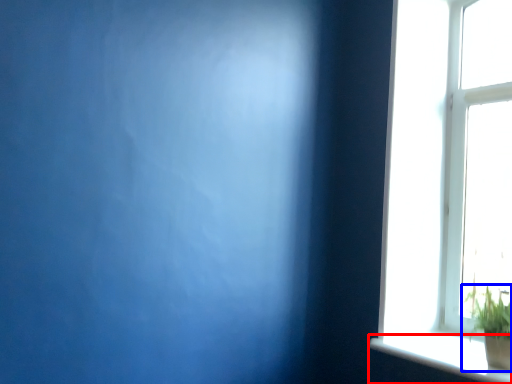
Question: Which object appears farthest to the camera in this image, window sill (highlighted by a red box) or houseplant (highlighted by a blue box)?

Choices:
 (A) window sill
 (B) houseplant

Answer: (B)